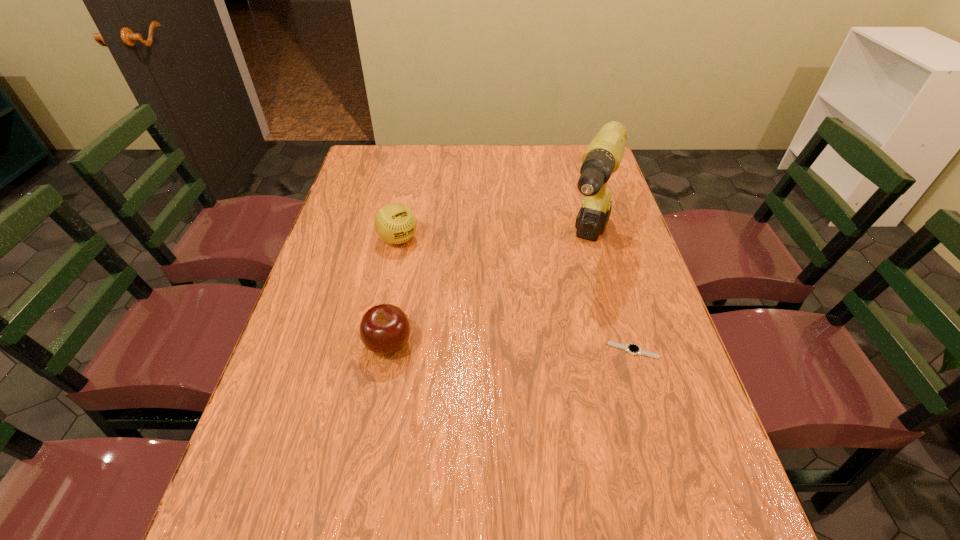
Where is `vacant space located 0.380m on the logo side of the softball`? vacant space located 0.380m on the logo side of the softball is located at coordinates (489, 335).

Where is `vacant region located on the logo side of the softball`? The width and height of the screenshot is (960, 540). vacant region located on the logo side of the softball is located at coordinates (x=433, y=275).

The width and height of the screenshot is (960, 540). What are the coordinates of `object that is at the left edge` in the screenshot? It's located at (395, 223).

At what (x,y) coordinates should I click in order to perform the action: click on watch that is at the right edge. Please return your answer as a coordinate pair (x, y). Looking at the image, I should click on (633, 349).

The width and height of the screenshot is (960, 540). In order to click on drill at the right edge in this screenshot , I will do `click(603, 156)`.

This screenshot has width=960, height=540. Identify the location of vacant space at the far edge of the desktop. (477, 167).

In the image, there is a desktop. Find the location of `vacant space at the left edge`. vacant space at the left edge is located at coordinates (348, 327).

Locate an element on the screen. free space at the right edge of the desktop is located at coordinates (627, 277).

Find the location of a particular element. This screenshot has height=540, width=960. empty location between the softball and the shortest object is located at coordinates (516, 295).

I want to click on free spot between the shortest object and the apple, so click(511, 347).